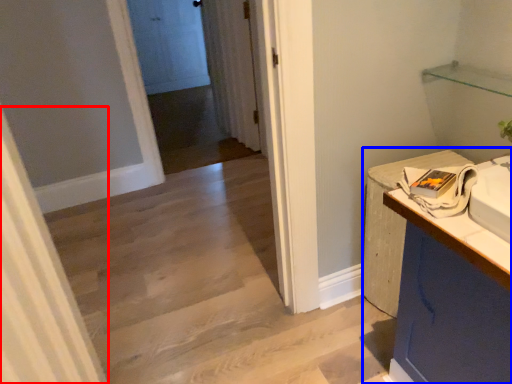
Question: Which of the following is the farthest to the observer, curtain (highlighted by a red box) or counter (highlighted by a blue box)?

Choices:
 (A) curtain
 (B) counter

Answer: (B)